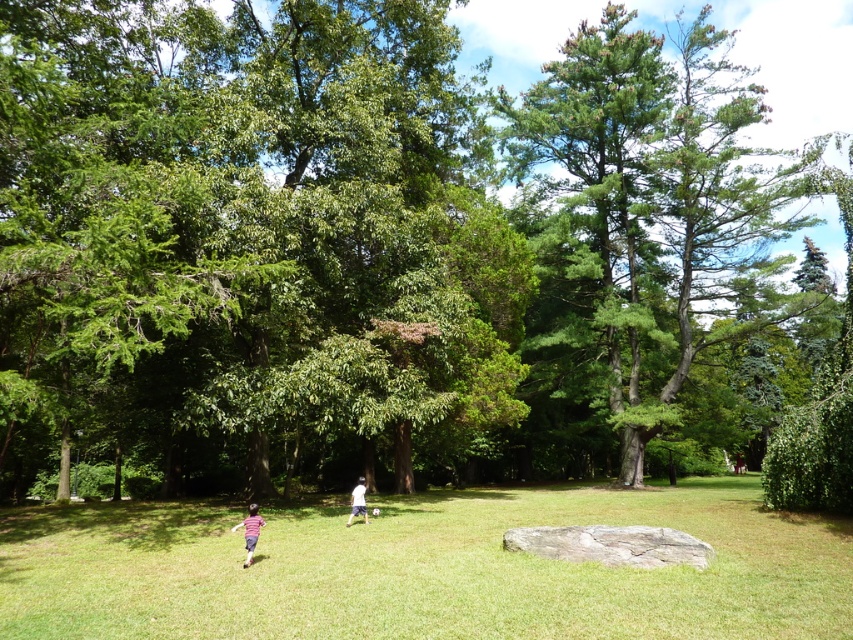
Does green grassy field at center appear under green needle-like tree at upper right?

Yes.

Who is more distant from viewer, (x=405, y=509) or (x=611, y=284)?

Point (x=611, y=284)

Is point (91, 545) positioned after point (602, 32)?

No.

I want to click on green grassy field at center, so click(x=422, y=568).

Can you confirm if green grassy field at center is bigger than white cotton shirt at center?

Yes.

Between point (102, 627) and point (352, 492), which one is positioned in front?

Point (102, 627)

In order to click on green grassy field at center in this screenshot , I will do `click(422, 568)`.

Does green needle-like tree at upper right appear under striped shirt at lower left?

Incorrect, green needle-like tree at upper right is not positioned below striped shirt at lower left.

Which of these two, green needle-like tree at upper right or striped shirt at lower left, stands taller?

Standing taller between the two is green needle-like tree at upper right.

What do you see at coordinates (648, 227) in the screenshot? I see `green needle-like tree at upper right` at bounding box center [648, 227].

Find the location of a particular element. The height and width of the screenshot is (640, 853). green needle-like tree at upper right is located at coordinates (648, 227).